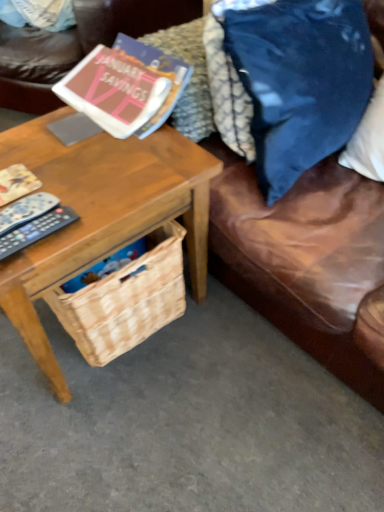
Image resolution: width=384 pixels, height=512 pixels. Identify the location of free space that is in between woodenobject at left and brown leather couch at lower right. (222, 387).